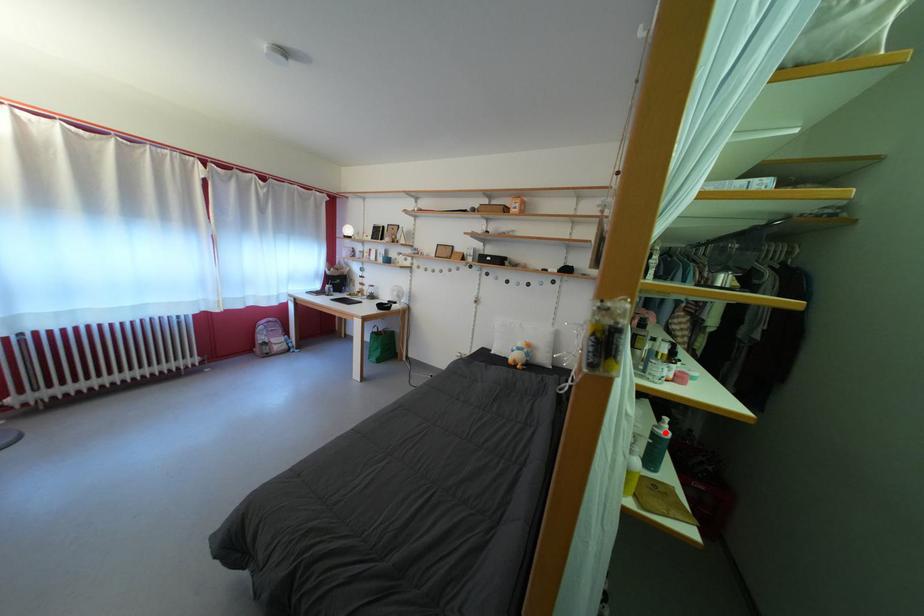
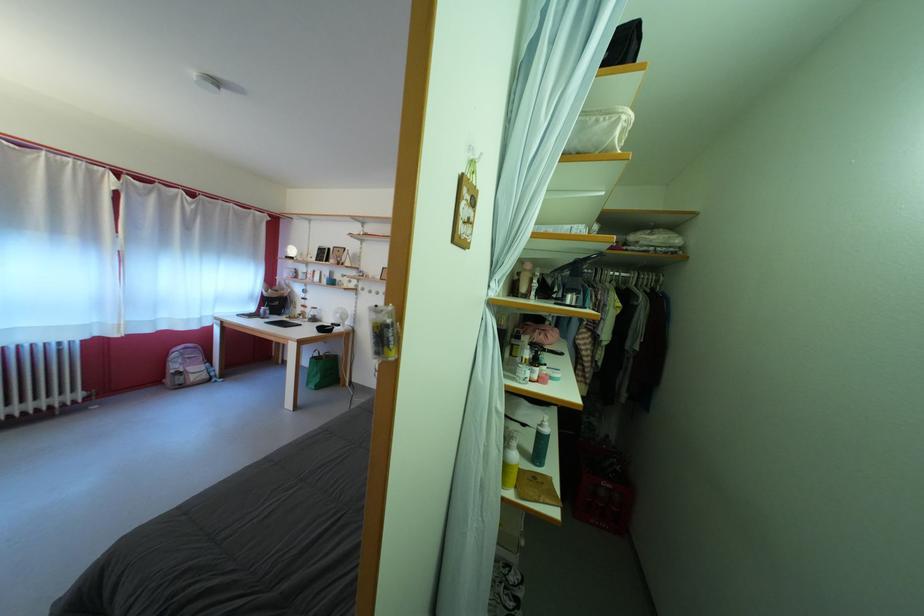
The point at the highlighted location is marked in the first image. Where is the corresponding point in the second image?

(549, 431)